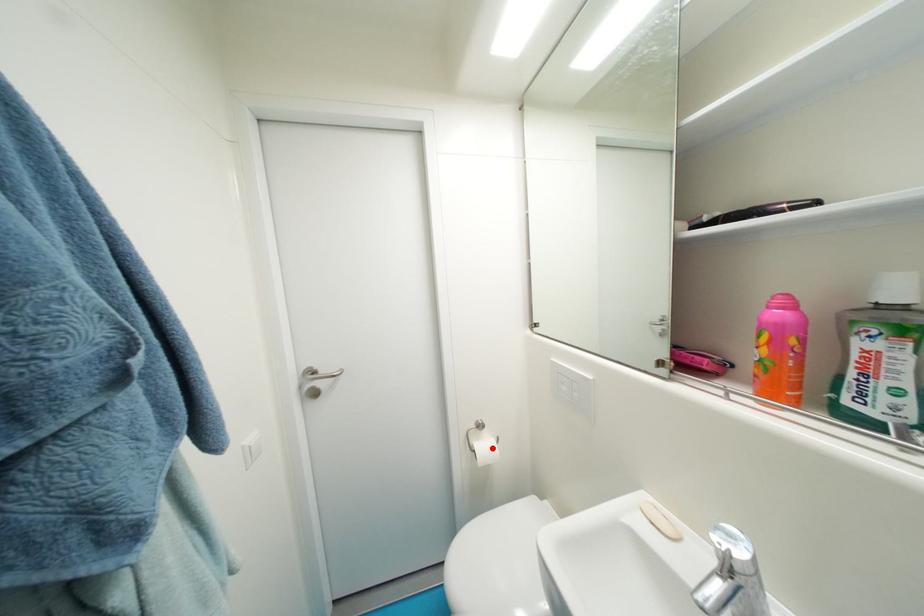
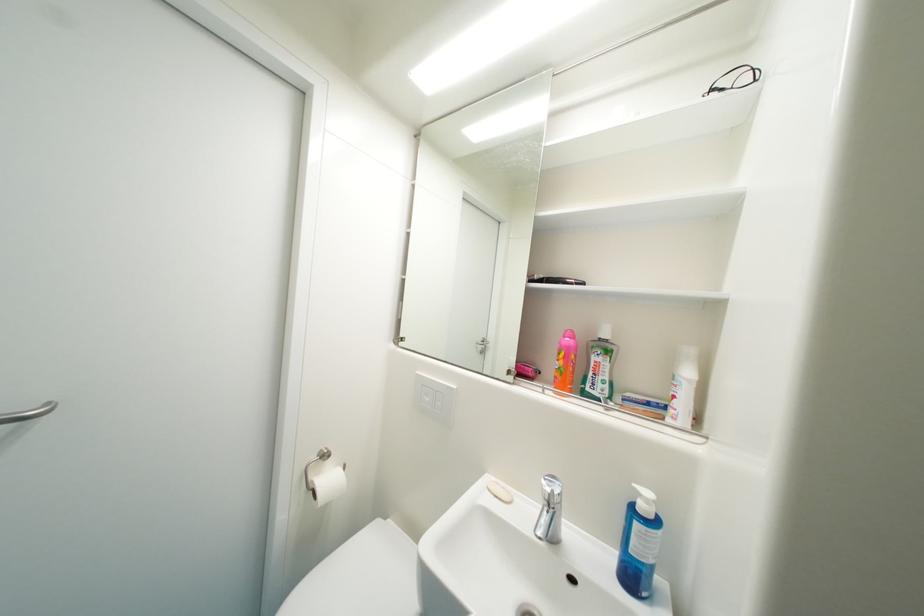
Question: A red point is marked in image1. In image2, is the corresponding 3D point closer to the camera or farther? Reply with the corresponding letter.

Choices:
 (A) The corresponding 3D point is closer.
 (B) The corresponding 3D point is farther.

Answer: (A)